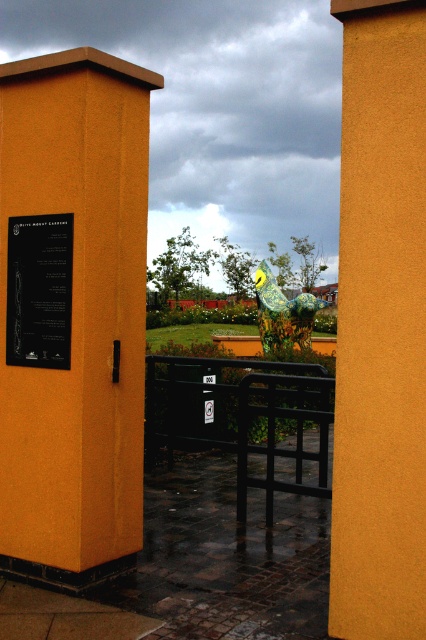
Does black metal fence at center appear over shiny metallic bird at center?

No, black metal fence at center is not above shiny metallic bird at center.

This screenshot has height=640, width=426. Find the location of `black metal fence at center`. black metal fence at center is located at coordinates (241, 416).

Is point (236, 468) less distant than point (270, 310)?

Yes, it is.

Identify the location of black metal fence at center. Image resolution: width=426 pixels, height=640 pixels. (241, 416).

You are a GUI agent. You are given a task and a screenshot of the screen. Output one action in this format:
    pyautogui.click(x=<x>, y=<y>)
    Task: Click on the matte yellow pillar at center
    This screenshot has height=640, width=426.
    Given the screenshot: What is the action you would take?
    pyautogui.click(x=379, y=326)

Is matte yellow pillar at center to the left of black metal fence at center from the viewer's perspective?

No, matte yellow pillar at center is not to the left of black metal fence at center.

Image resolution: width=426 pixels, height=640 pixels. What do you see at coordinates (379, 326) in the screenshot?
I see `matte yellow pillar at center` at bounding box center [379, 326].

Find the location of a particular element. matte yellow pillar at center is located at coordinates (379, 326).

Is the position of orange matte pillar at left less distant than that of shiny metallic bird at center?

That is True.

Who is shorter, orange matte pillar at left or shiny metallic bird at center?

shiny metallic bird at center is shorter.

Locate an element on the screen. Image resolution: width=426 pixels, height=640 pixels. orange matte pillar at left is located at coordinates (72, 314).